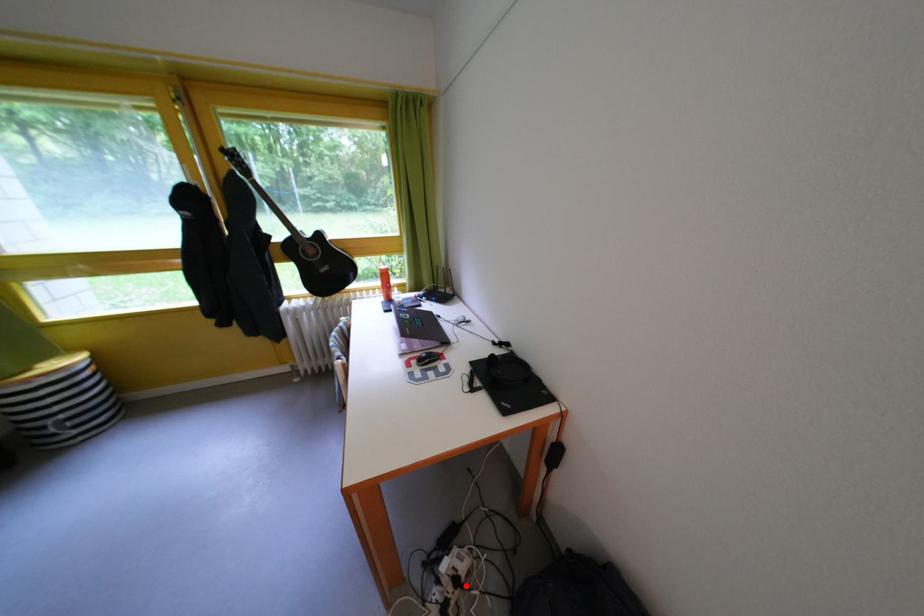
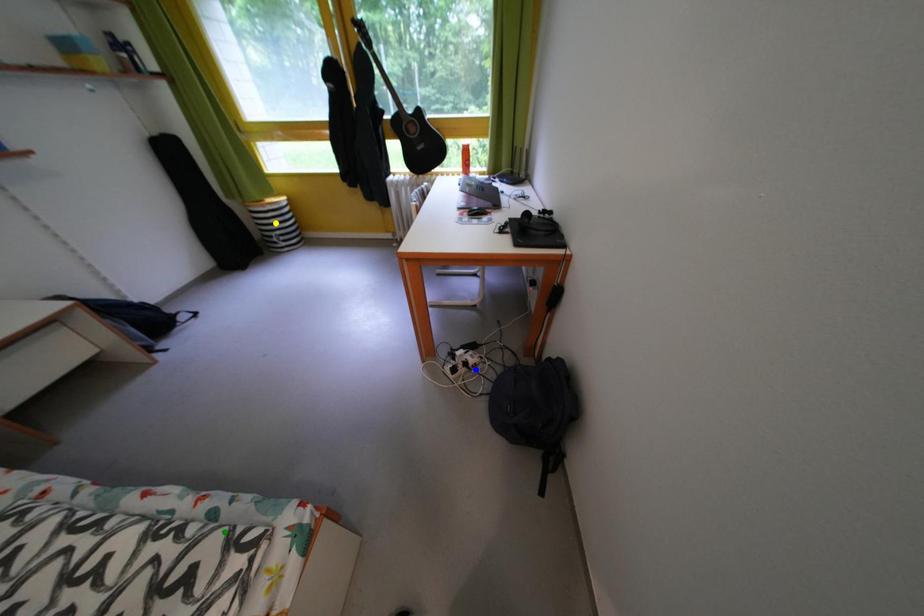
Question: I am providing you with two images of the same scene from different viewpoints. A red point is marked on the first image. You are given multiple points on the second image. Can you choose the point in image 2 that corresponds to the point in image 1?

Choices:
 (A) yellow point
 (B) green point
 (C) blue point

Answer: (C)